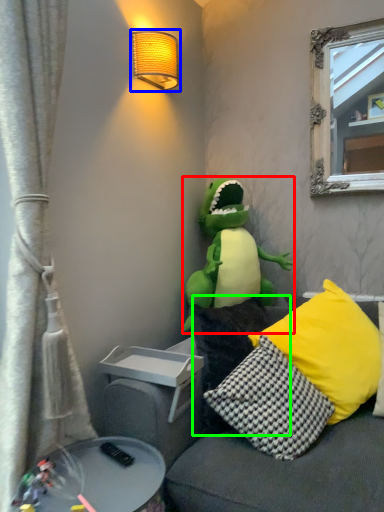
Question: Based on their relative distances, which object is nearer to toy (highlighted by a red box)? Choose from lamp (highlighted by a blue box) and pillow (highlighted by a green box).

Choices:
 (A) lamp
 (B) pillow

Answer: (B)